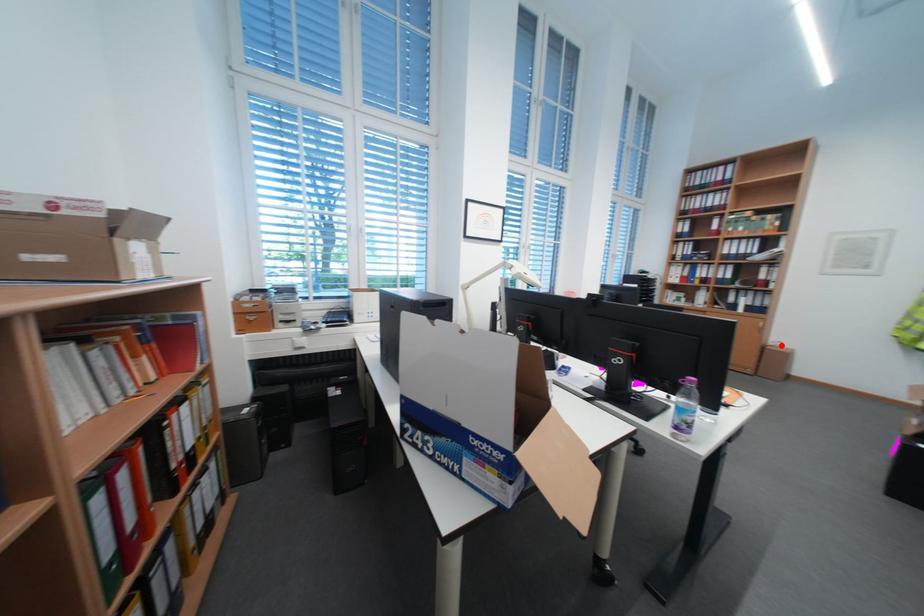
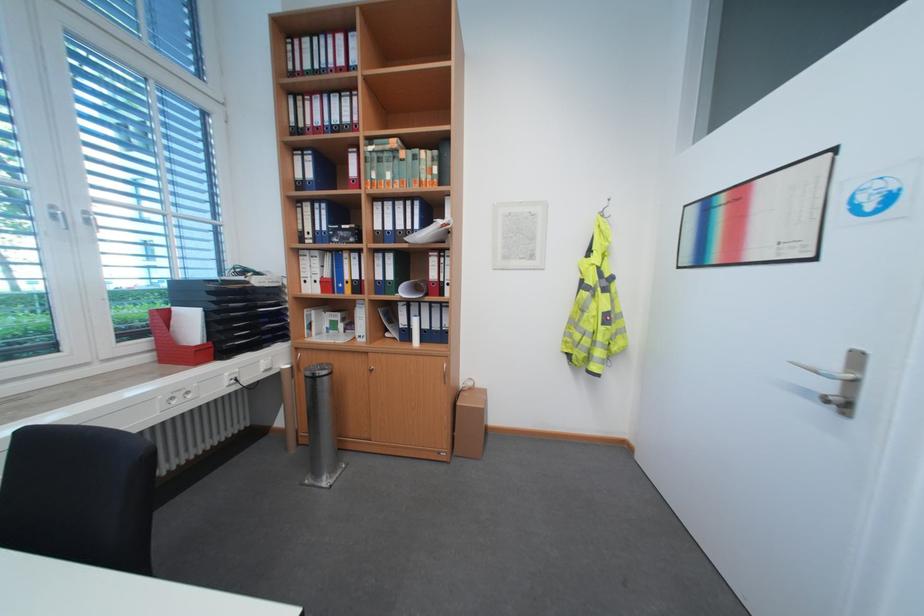
Find the pixel in the second image that matches the highlighted location in the first image.

(472, 387)